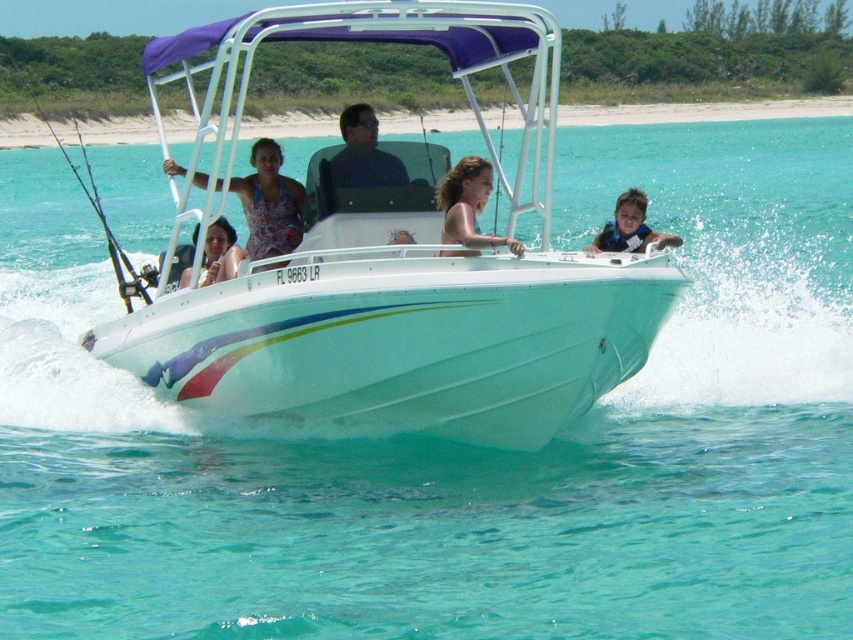
Is matte floral dress at center bigger than blue life vest at center?

Actually, matte floral dress at center might be smaller than blue life vest at center.

Is point (271, 248) closer to camera compared to point (625, 244)?

Yes, point (271, 248) is in front of point (625, 244).

This screenshot has width=853, height=640. What do you see at coordinates (270, 204) in the screenshot?
I see `matte floral dress at center` at bounding box center [270, 204].

You are a GUI agent. You are given a task and a screenshot of the screen. Output one action in this format:
    pyautogui.click(x=<x>, y=<y>)
    Task: Click on the matte floral dress at center
    The image size is (853, 640).
    Given the screenshot: What is the action you would take?
    pyautogui.click(x=270, y=204)

The width and height of the screenshot is (853, 640). What do you see at coordinates (397, 264) in the screenshot?
I see `white glossy boat at center` at bounding box center [397, 264].

Who is positioned more to the left, white glossy boat at center or blue life vest at center?

Positioned to the left is white glossy boat at center.

Between point (469, 272) and point (625, 218), which one is positioned behind?

The point (625, 218) is behind.

The height and width of the screenshot is (640, 853). I want to click on white glossy boat at center, so click(x=397, y=264).

Can you confirm if matte black shirt at center is wider than matte pink dress at center?

Indeed, matte black shirt at center has a greater width compared to matte pink dress at center.

Which is more to the left, matte black shirt at center or matte pink dress at center?

matte pink dress at center

What are the coordinates of `matte black shirt at center` in the screenshot? It's located at (363, 154).